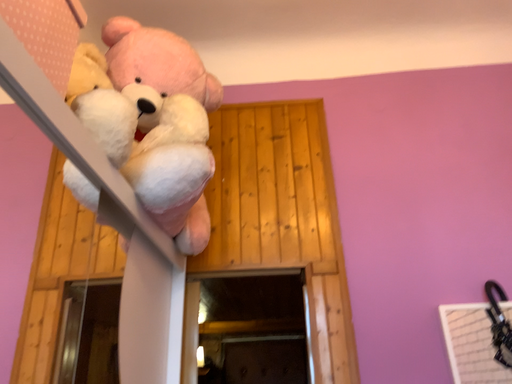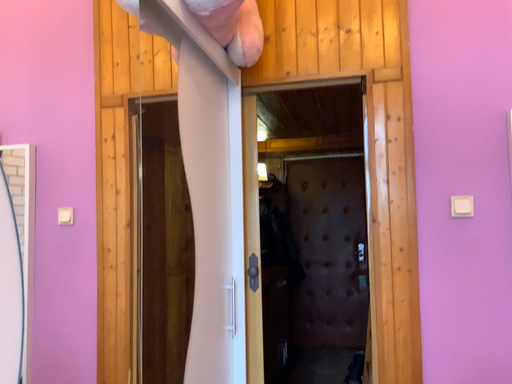
Question: Which way did the camera rotate in the video?

Choices:
 (A) rotated right
 (B) rotated left

Answer: (B)